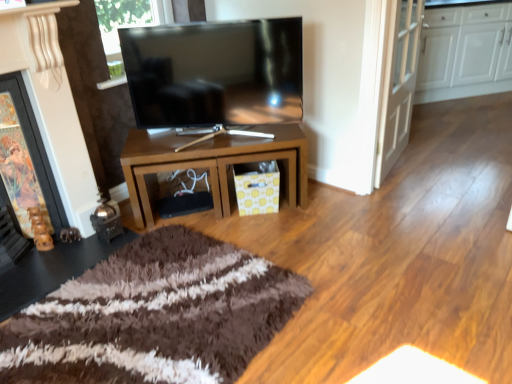
Question: Is wooden fireplace at left directly adjacent to brown glossy table at center?

Choices:
 (A) yes
 (B) no

Answer: (B)

Question: Is wooden fireplace at left facing towards brown glossy table at center?

Choices:
 (A) yes
 (B) no

Answer: (B)

Question: Considering the relative sizes of wooden fireplace at left and brown glossy table at center in the image provided, is wooden fireplace at left wider than brown glossy table at center?

Choices:
 (A) no
 (B) yes

Answer: (A)

Question: From the image's perspective, is wooden fireplace at left over brown glossy table at center?

Choices:
 (A) no
 (B) yes

Answer: (A)

Question: Is wooden fireplace at left further to the viewer compared to brown glossy table at center?

Choices:
 (A) yes
 (B) no

Answer: (B)

Question: Looking at their shapes, would you say white glossy door at upper right is wider or thinner than white glossy cabinets at upper right?

Choices:
 (A) thin
 (B) wide

Answer: (A)

Question: Is point (388, 125) positioned closer to the camera than point (472, 69)?

Choices:
 (A) farther
 (B) closer

Answer: (B)

Question: From a real-world perspective, is white glossy door at upper right positioned above or below white glossy cabinets at upper right?

Choices:
 (A) below
 (B) above

Answer: (B)

Question: Based on their positions, is white glossy door at upper right located to the left or right of white glossy cabinets at upper right?

Choices:
 (A) left
 (B) right

Answer: (A)

Question: Considering their positions, is white glossy door at upper right located in front of or behind wooden fireplace at left?

Choices:
 (A) front
 (B) behind

Answer: (B)

Question: From their relative heights in the image, would you say white glossy door at upper right is taller or shorter than wooden fireplace at left?

Choices:
 (A) short
 (B) tall

Answer: (B)

Question: Considering the relative positions of white glossy door at upper right and wooden fireplace at left in the image provided, is white glossy door at upper right to the left or to the right of wooden fireplace at left?

Choices:
 (A) right
 (B) left

Answer: (A)

Question: From the image's perspective, is white glossy door at upper right located above or below wooden fireplace at left?

Choices:
 (A) above
 (B) below

Answer: (A)

Question: From the image's perspective, is matte black tv at center located above or below brown glossy table at center?

Choices:
 (A) below
 (B) above

Answer: (B)

Question: In the image, is matte black tv at center on the left side or the right side of brown glossy table at center?

Choices:
 (A) left
 (B) right

Answer: (A)